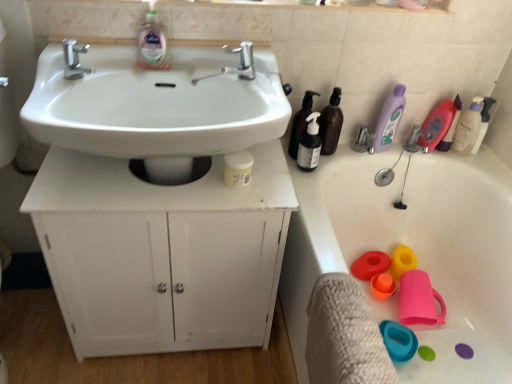
Question: Is pink rubber cup at lower right, arranged as the 1th toy when viewed from the back, taller or shorter than white glossy sink at center?

Choices:
 (A) short
 (B) tall

Answer: (A)

Question: From a real-world perspective, is pink rubber cup at lower right, which is counted as the fourth toy, starting from the front, positioned above or below white glossy sink at center?

Choices:
 (A) below
 (B) above

Answer: (A)

Question: Considering the real-world distances, which object is farthest from the white matte cabinet at center?

Choices:
 (A) polished chrome faucet at upper left, the 1th tap from the left
 (B) textured white towel at lower right
 (C) matte red plastic toy at lower right, the second toy from the back
 (D) white pump bottle at upper right, the 1th cleaning product in the right-to-left sequence
 (E) white matte jar at center, arranged as the first toiletry when viewed from the front

Answer: (D)

Question: Estimate the real-world distances between objects in this image. Which object is farther from the textured white towel at lower right?

Choices:
 (A) white glossy sink at center
 (B) matte plastic bath at right
 (C) purple translucent bottle at upper right, arranged as the fourth cleaning product when viewed from the right
 (D) pink rubber cup at lower right, arranged as the 1th toy when viewed from the back
 (E) polished chrome tap at upper center, which ranks as the 1th tap in right-to-left order

Answer: (C)